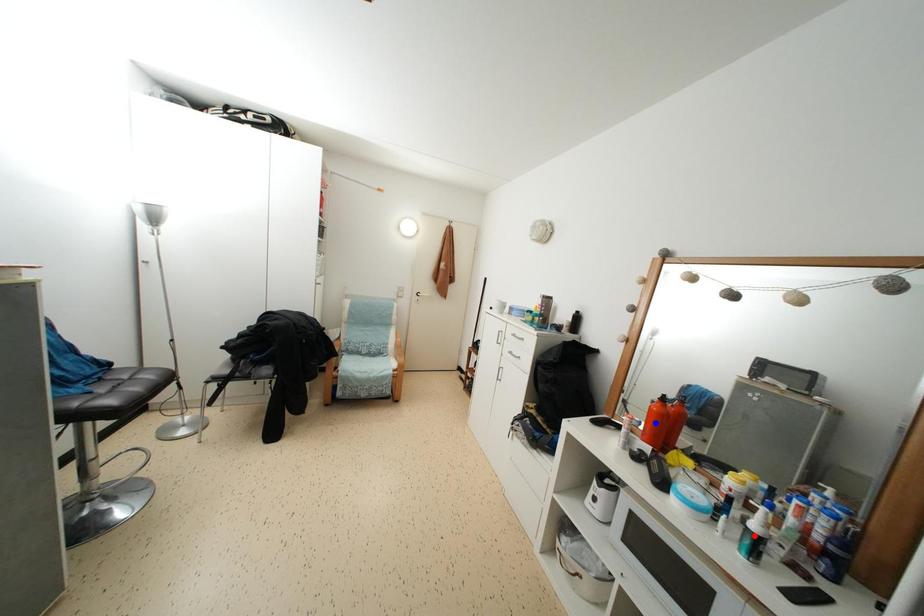
Question: Two points are marked on the image. Which point is closer to the camera?

Choices:
 (A) Blue point is closer.
 (B) Red point is closer.

Answer: (B)